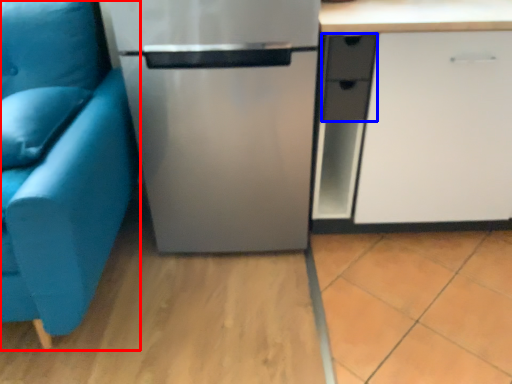
Question: Which point is further to the camera, studio couch (highlighted by a red box) or drawer (highlighted by a blue box)?

Choices:
 (A) studio couch
 (B) drawer

Answer: (B)